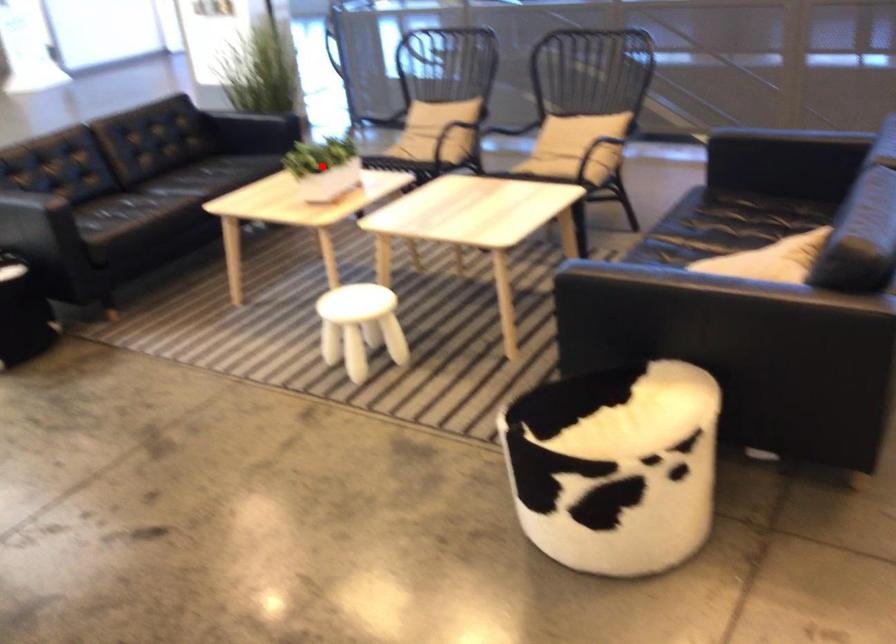
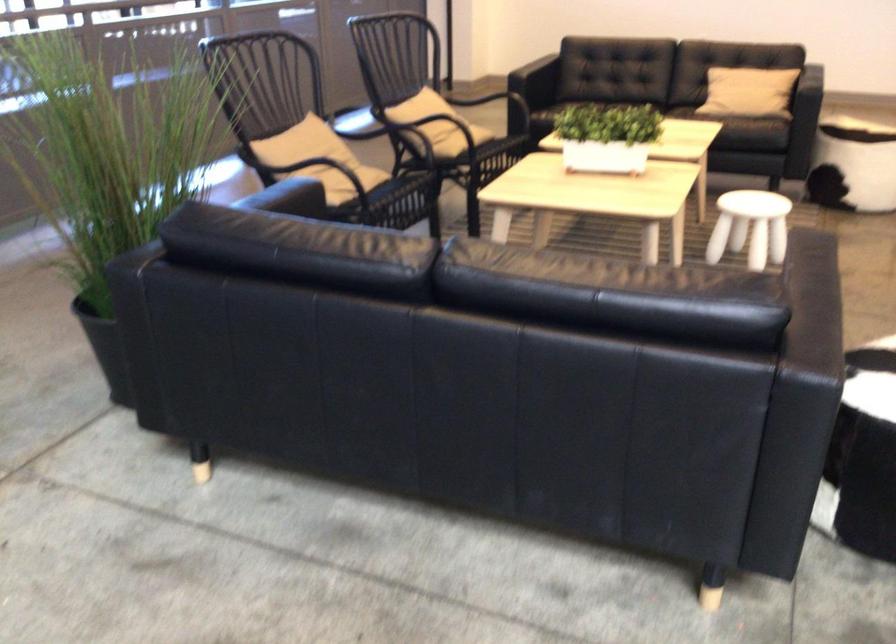
Find the pixel in the second image that matches the highlighted location in the first image.

(607, 137)